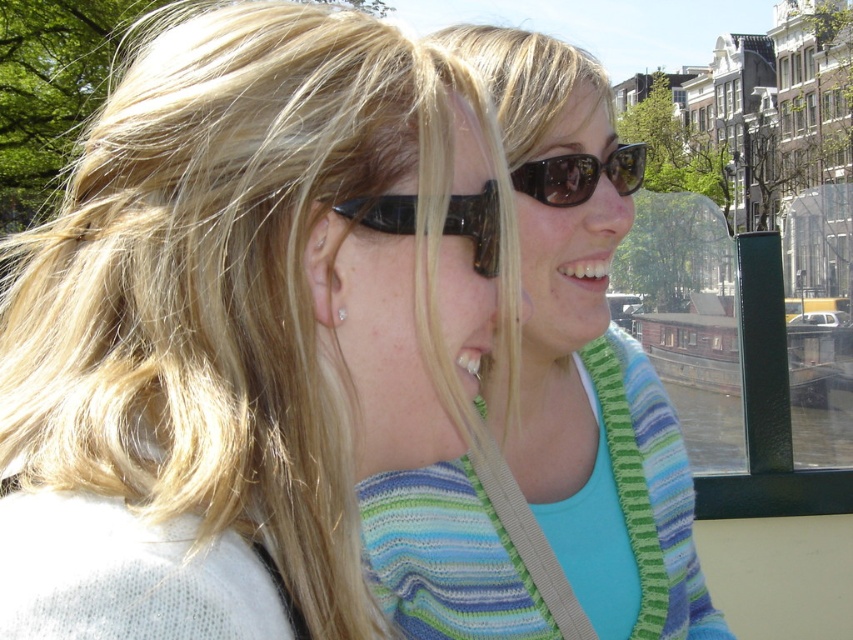
Question: Is matte black sunglasses at upper center wider than striped sweater at center?

Choices:
 (A) no
 (B) yes

Answer: (B)

Question: Does black plastic sunglasses at upper center appear on the right side of matte silver earring at center?

Choices:
 (A) no
 (B) yes

Answer: (A)

Question: Which point is farther to the camera?

Choices:
 (A) matte black sunglasses at upper center
 (B) striped sweater at center
 (C) white glossy teeth at center
 (D) black plastic sunglasses at upper center

Answer: (C)

Question: Does striped sweater at center appear on the right side of black matte sunglasses at upper center?

Choices:
 (A) no
 (B) yes

Answer: (A)

Question: Estimate the real-world distances between objects in this image. Which object is farther from the white glossy teeth at center?

Choices:
 (A) matte silver earring at center
 (B) striped sweater at center

Answer: (A)

Question: Among these points, which one is nearest to the camera?

Choices:
 (A) (531, 125)
 (B) (589, 280)
 (C) (231, 337)

Answer: (C)